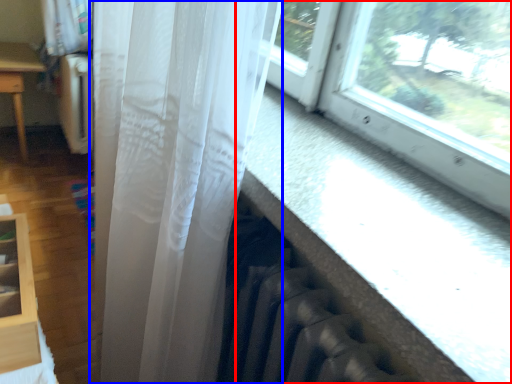
Question: Which object appears farthest to the camera in this image, window (highlighted by a red box) or curtain (highlighted by a blue box)?

Choices:
 (A) window
 (B) curtain

Answer: (B)